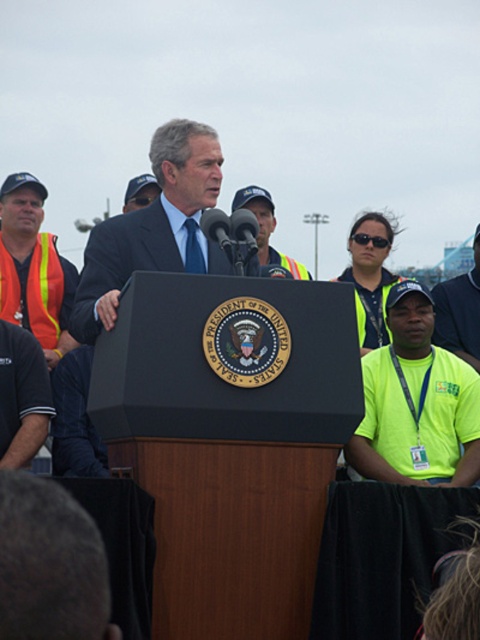
From the picture: Is blue suit at center thinner than orange reflective safety vest at left?

Incorrect, blue suit at center's width is not less than orange reflective safety vest at left's.

Between point (166, 177) and point (47, 268), which one is positioned in front?

Positioned in front is point (166, 177).

Is point (180, 220) closer to viewer compared to point (36, 291)?

Yes, point (180, 220) is in front of point (36, 291).

Find the location of `blue suit at center`. blue suit at center is located at coordinates (155, 227).